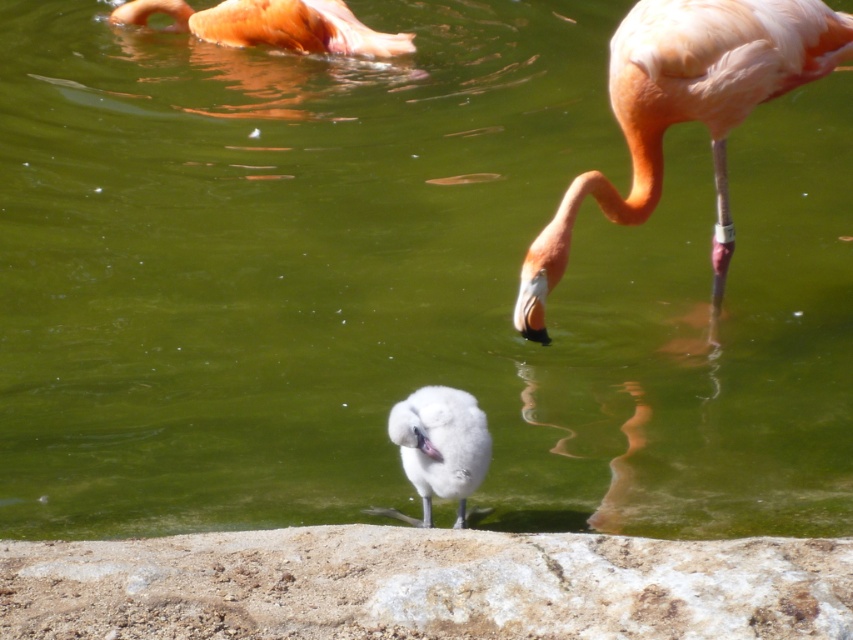
You are a photographer standing at the edge of the water body. You want to take a photo that includes both the small bird and the two adult flamingos in the background. The small bird is at point (389, 51) and the two adults are at point (451, 452). Which point is closer to you so you can focus your camera properly?

Point (389, 51) is closer to you than point (451, 452), so you should focus your camera on that point first to capture the small bird clearly.

Based on the scene description, where is the matte pink flamingo at upper right located in terms of its 2D coordinates?

The matte pink flamingo at upper right is located at the 2D coordinates of point [685,109].